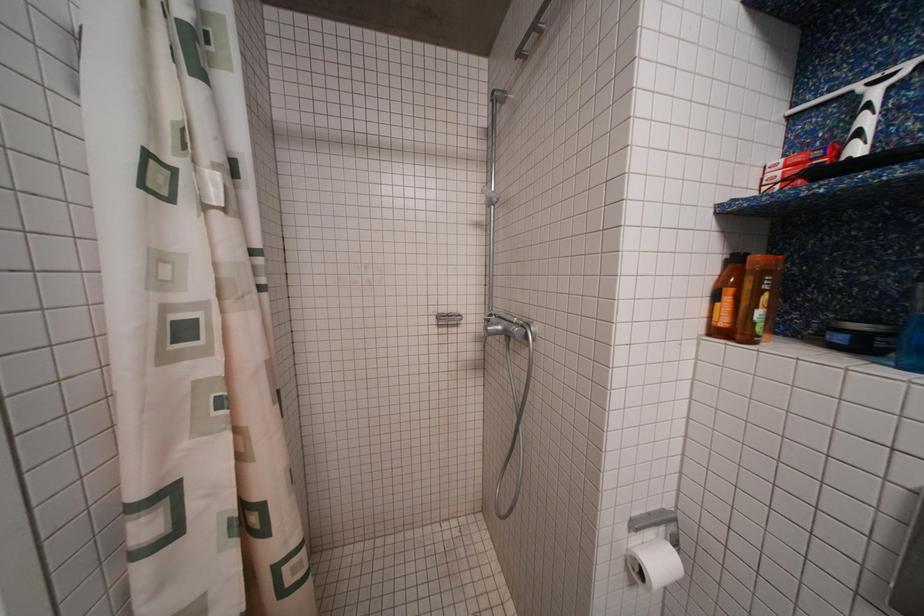
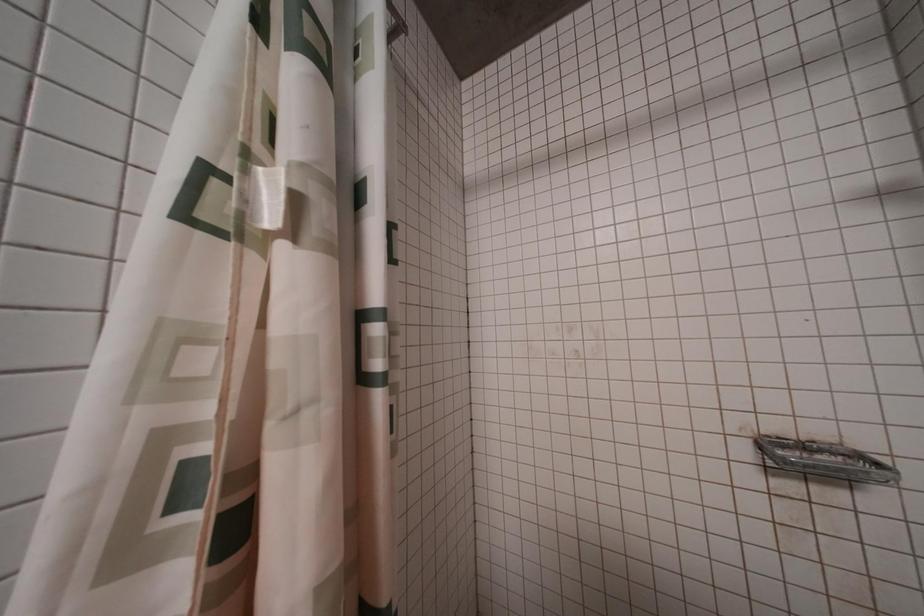
Question: The first image is from the beginning of the video and the second image is from the end. How did the camera likely rotate when shooting the video?

Choices:
 (A) Left
 (B) Right
 (C) Up
 (D) Down

Answer: (A)